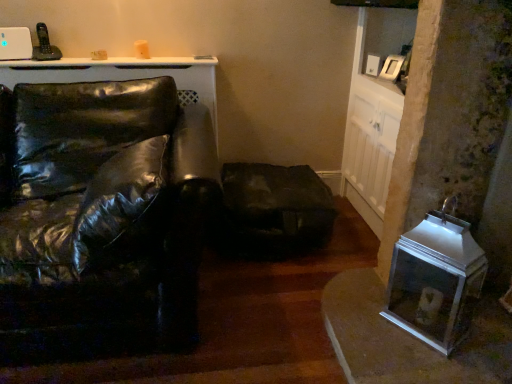
Where is `metallic silver pet carrier at lower right`? The width and height of the screenshot is (512, 384). metallic silver pet carrier at lower right is located at coordinates (436, 280).

The width and height of the screenshot is (512, 384). What do you see at coordinates (436, 280) in the screenshot? I see `metallic silver pet carrier at lower right` at bounding box center [436, 280].

Where is `glossy black leather couch at left`? glossy black leather couch at left is located at coordinates (101, 217).

Where is `dark brown leather swivel chair at center`? dark brown leather swivel chair at center is located at coordinates pos(274,210).

Locate an element on the screen. Image resolution: width=512 pixels, height=384 pixels. metallic silver pet carrier at lower right is located at coordinates (436, 280).

Looking at this image, is dark brown leather swivel chair at center closer to the viewer compared to metallic silver pet carrier at lower right?

No, dark brown leather swivel chair at center is behind metallic silver pet carrier at lower right.

Which is more to the right, dark brown leather swivel chair at center or metallic silver pet carrier at lower right?

Positioned to the right is metallic silver pet carrier at lower right.

Which of these two, dark brown leather swivel chair at center or metallic silver pet carrier at lower right, is bigger?

Bigger between the two is dark brown leather swivel chair at center.

Who is taller, metallic silver pet carrier at lower right or dark brown leather swivel chair at center?

metallic silver pet carrier at lower right is taller.

Can you see metallic silver pet carrier at lower right touching dark brown leather swivel chair at center?

They are not placed beside each other.

In the image, there is a dark brown leather swivel chair at center. What are the coordinates of `appliance below it (from the image's perspective)` in the screenshot? It's located at (436, 280).

Is point (397, 300) closer to camera compared to point (289, 186)?

Yes, point (397, 300) is closer to viewer.

Is glossy black leather couch at left facing away from metallic silver pet carrier at lower right?

No.

Considering the points (18, 222) and (428, 291), which point is in front, point (18, 222) or point (428, 291)?

The point (18, 222) is closer to the camera.

Is glossy black leather couch at left surrounding metallic silver pet carrier at lower right?

No.

From a real-world perspective, which object rests below the other?

metallic silver pet carrier at lower right is physically lower.

Between glossy black leather couch at left and dark brown leather swivel chair at center, which one has less height?

Standing shorter between the two is dark brown leather swivel chair at center.

Is glossy black leather couch at left at the right side of dark brown leather swivel chair at center?

No.

Looking at this image, between glossy black leather couch at left and dark brown leather swivel chair at center, which one has larger width?

glossy black leather couch at left.

Is point (114, 215) positioned in front of point (287, 180)?

Yes.

From the image's perspective, is metallic silver pet carrier at lower right located above glossy black leather couch at left?

Actually, metallic silver pet carrier at lower right appears below glossy black leather couch at left in the image.

From a real-world perspective, is metallic silver pet carrier at lower right physically above glossy black leather couch at left?

No, from a real-world perspective, metallic silver pet carrier at lower right is not on top of glossy black leather couch at left.

What's the angular difference between metallic silver pet carrier at lower right and glossy black leather couch at left's facing directions?

The facing directions of metallic silver pet carrier at lower right and glossy black leather couch at left are 56.3 degrees apart.

This screenshot has height=384, width=512. I want to click on studio couch on the left of metallic silver pet carrier at lower right, so click(x=101, y=217).

Is dark brown leather swivel chair at center facing away from glossy black leather couch at left?

No, glossy black leather couch at left is not at the back of dark brown leather swivel chair at center.

Consider the image. From a real-world perspective, is dark brown leather swivel chair at center above or below glossy black leather couch at left?

dark brown leather swivel chair at center is below glossy black leather couch at left.

Locate an element on the screen. swivel chair on the right of glossy black leather couch at left is located at coordinates (274, 210).

Considering the relative positions of dark brown leather swivel chair at center and glossy black leather couch at left in the image provided, is dark brown leather swivel chair at center to the right of glossy black leather couch at left from the viewer's perspective?

Correct, you'll find dark brown leather swivel chair at center to the right of glossy black leather couch at left.

At what (x,y) coordinates should I click in order to perform the action: click on appliance below the dark brown leather swivel chair at center (from the image's perspective). Please return your answer as a coordinate pair (x, y). The image size is (512, 384). Looking at the image, I should click on (436, 280).

Where is `swivel chair below the metallic silver pet carrier at lower right (from a real-world perspective)`? swivel chair below the metallic silver pet carrier at lower right (from a real-world perspective) is located at coordinates (274, 210).

Looking at the image, which one is located closer to glossy black leather couch at left, metallic silver pet carrier at lower right or dark brown leather swivel chair at center?

Among the two, dark brown leather swivel chair at center is located nearer to glossy black leather couch at left.

Considering their positions, is glossy black leather couch at left positioned further to metallic silver pet carrier at lower right than dark brown leather swivel chair at center?

glossy black leather couch at left is further to metallic silver pet carrier at lower right.

Based on their spatial positions, is dark brown leather swivel chair at center or glossy black leather couch at left closer to metallic silver pet carrier at lower right?

The object closer to metallic silver pet carrier at lower right is dark brown leather swivel chair at center.

In the scene shown: From the image, which object appears to be nearer to dark brown leather swivel chair at center, metallic silver pet carrier at lower right or glossy black leather couch at left?

metallic silver pet carrier at lower right is positioned closer to the anchor dark brown leather swivel chair at center.

Considering their positions, is glossy black leather couch at left positioned further to dark brown leather swivel chair at center than metallic silver pet carrier at lower right?

glossy black leather couch at left lies further to dark brown leather swivel chair at center than the other object.

From the image, which object appears to be nearer to glossy black leather couch at left, dark brown leather swivel chair at center or metallic silver pet carrier at lower right?

The object closer to glossy black leather couch at left is dark brown leather swivel chair at center.

The width and height of the screenshot is (512, 384). I want to click on swivel chair situated between glossy black leather couch at left and metallic silver pet carrier at lower right from left to right, so click(x=274, y=210).